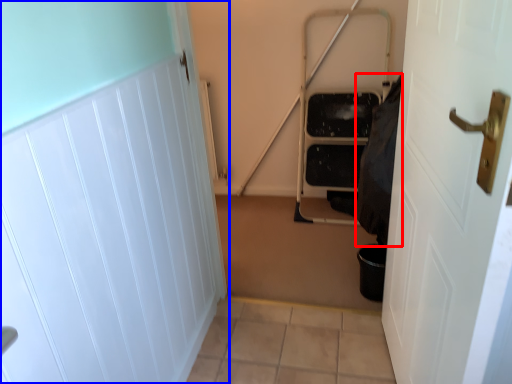
Question: Which of the following is the closest to the observer, material (highlighted by a red box) or door (highlighted by a blue box)?

Choices:
 (A) material
 (B) door

Answer: (B)